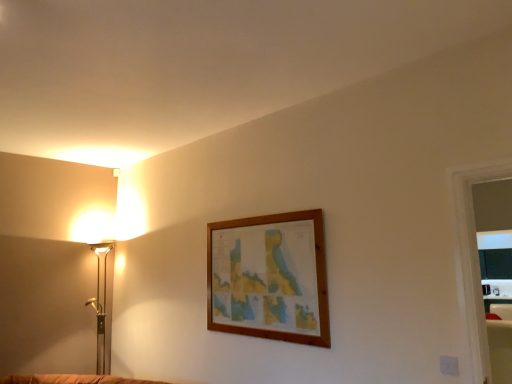
Question: Should I look upward or downward to see gold metallic floor lamp at left?

Choices:
 (A) up
 (B) down

Answer: (B)